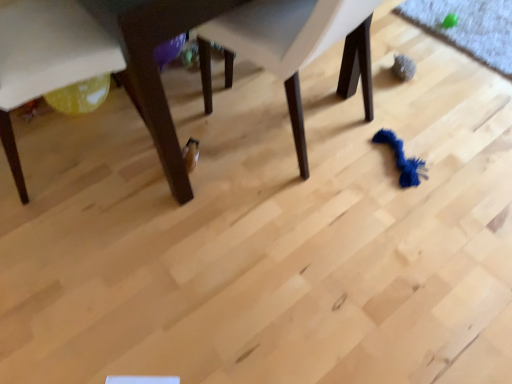
Question: Is matte white chair at lower left, placed as the first chair when sorted from left to right, turned away from wooden table at center?

Choices:
 (A) no
 (B) yes

Answer: (A)

Question: Would you consider matte white chair at lower left, placed as the first chair when sorted from left to right, to be distant from wooden table at center?

Choices:
 (A) no
 (B) yes

Answer: (A)

Question: Considering the relative positions of matte white chair at lower left, placed as the first chair when sorted from left to right, and wooden table at center in the image provided, is matte white chair at lower left, placed as the first chair when sorted from left to right, behind wooden table at center?

Choices:
 (A) no
 (B) yes

Answer: (B)

Question: Does matte white chair at lower left, acting as the second chair starting from the right, have a lesser width compared to wooden table at center?

Choices:
 (A) yes
 (B) no

Answer: (A)

Question: Considering the relative positions of matte white chair at lower left, acting as the second chair starting from the right, and wooden table at center in the image provided, is matte white chair at lower left, acting as the second chair starting from the right, to the right of wooden table at center from the viewer's perspective?

Choices:
 (A) no
 (B) yes

Answer: (A)

Question: Is matte white chair at lower left, placed as the first chair when sorted from left to right, wider or thinner than wooden table at center?

Choices:
 (A) thin
 (B) wide

Answer: (A)

Question: From a real-world perspective, is matte white chair at lower left, acting as the second chair starting from the right, above or below wooden table at center?

Choices:
 (A) above
 (B) below

Answer: (B)

Question: Considering the relative positions of matte white chair at lower left, placed as the first chair when sorted from left to right, and wooden table at center in the image provided, is matte white chair at lower left, placed as the first chair when sorted from left to right, to the left or to the right of wooden table at center?

Choices:
 (A) right
 (B) left

Answer: (B)

Question: In terms of size, does matte white chair at lower left, acting as the second chair starting from the right, appear bigger or smaller than wooden table at center?

Choices:
 (A) small
 (B) big

Answer: (A)

Question: From the image's perspective, relative to white plastic chair at center, positioned as the 1th chair in right-to-left order, is wooden table at center above or below?

Choices:
 (A) above
 (B) below

Answer: (A)

Question: Based on their sizes in the image, would you say wooden table at center is bigger or smaller than white plastic chair at center, marked as the 2th chair in a left-to-right arrangement?

Choices:
 (A) small
 (B) big

Answer: (B)

Question: Does point (53, 31) appear closer or farther from the camera than point (278, 19)?

Choices:
 (A) farther
 (B) closer

Answer: (A)

Question: In the image, is wooden table at center on the left side or the right side of white plastic chair at center, positioned as the 1th chair in right-to-left order?

Choices:
 (A) right
 (B) left

Answer: (B)

Question: From the image's perspective, is matte white chair at lower left, placed as the first chair when sorted from left to right, above or below white plastic chair at center, marked as the 2th chair in a left-to-right arrangement?

Choices:
 (A) above
 (B) below

Answer: (B)

Question: Is matte white chair at lower left, placed as the first chair when sorted from left to right, in front of or behind white plastic chair at center, positioned as the 1th chair in right-to-left order, in the image?

Choices:
 (A) front
 (B) behind

Answer: (B)